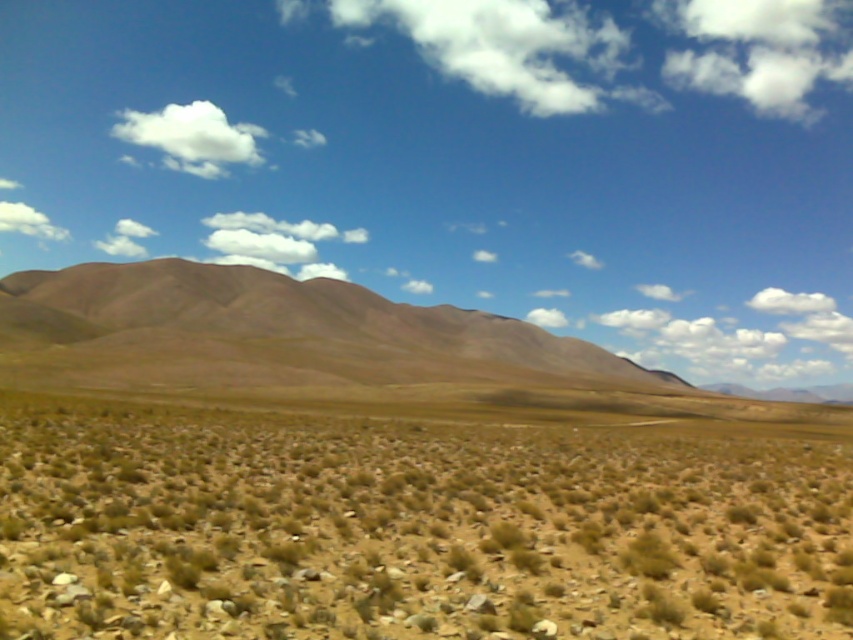
Does brown dry grass at center have a greater width compared to white fluffy cloud at upper center?

No.

Measure the distance between point [401,560] and camera.

Point [401,560] and camera are 8.52 meters apart.

Between point (697, 452) and point (172, 115), which one is positioned in front?

Point (697, 452)

Identify the location of brown dry grass at center. point(413,528).

Does brown/dry soil at center have a smaller size compared to white fluffy cloud at upper left?

No.

Is brown/dry soil at center shorter than white fluffy cloud at upper left?

In fact, brown/dry soil at center may be taller than white fluffy cloud at upper left.

Does point (207, 314) come farther from viewer compared to point (41, 225)?

That is False.

You are a GUI agent. You are given a task and a screenshot of the screen. Output one action in this format:
    pyautogui.click(x=<x>, y=<y>)
    Task: Click on the brown/dry soil at center
    The height and width of the screenshot is (640, 853).
    Given the screenshot: What is the action you would take?
    pyautogui.click(x=276, y=333)

Which is more to the right, brown dry grass at center or white fluffy cloud at upper left?

brown dry grass at center is more to the right.

Who is positioned more to the left, brown dry grass at center or white fluffy cloud at upper left?

Positioned to the left is white fluffy cloud at upper left.

Which is behind, point (780, 586) or point (4, 225)?

The point (4, 225) is more distant.

Image resolution: width=853 pixels, height=640 pixels. I want to click on brown dry grass at center, so click(x=413, y=528).